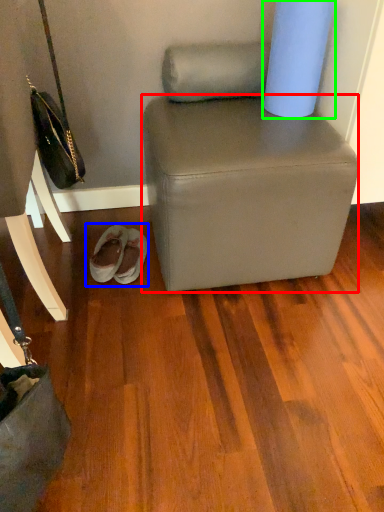
Question: Which object is positioned farthest from stool (highlighted by a red box)? Select from footwear (highlighted by a blue box) and toilet paper (highlighted by a green box).

Choices:
 (A) footwear
 (B) toilet paper

Answer: (A)